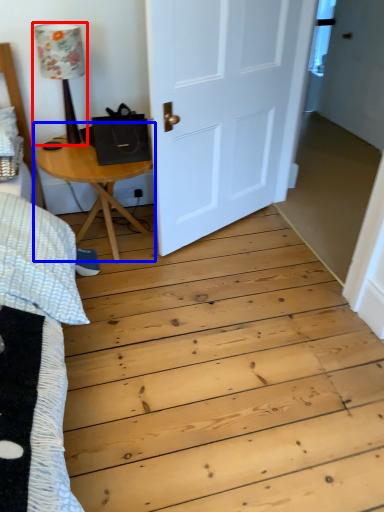
Question: Which point is further to the camera, lamp (highlighted by a red box) or table (highlighted by a blue box)?

Choices:
 (A) lamp
 (B) table

Answer: (B)